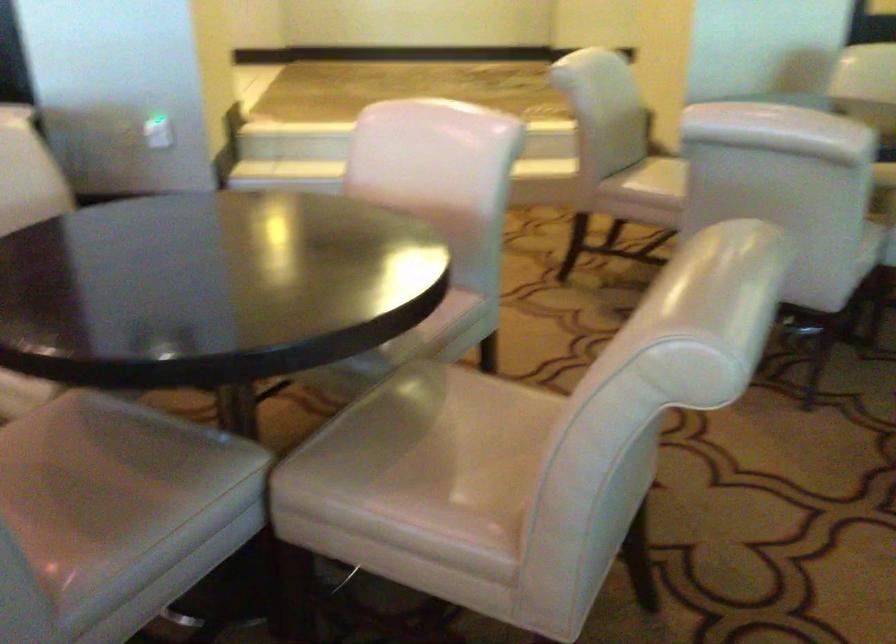
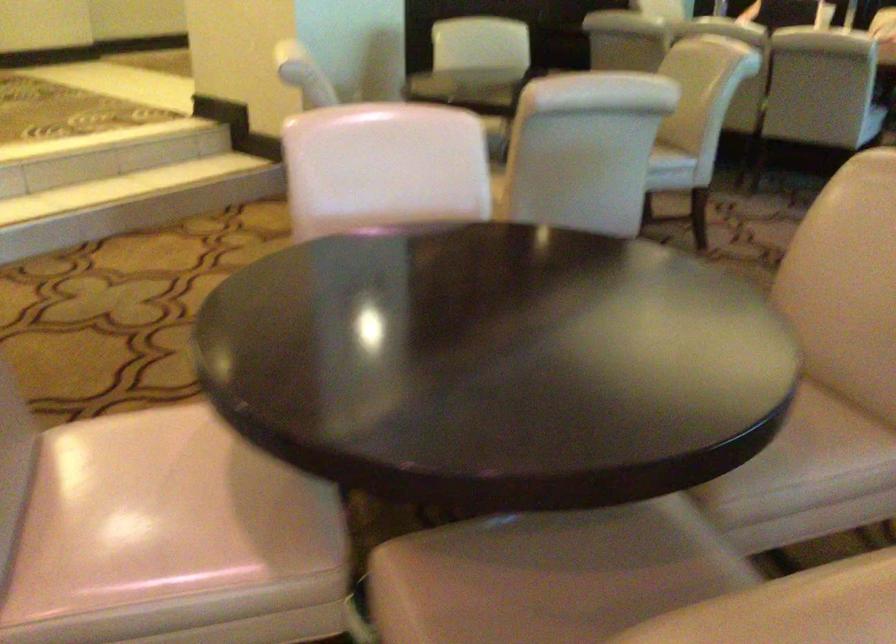
The point at (96, 460) is marked in the first image. Where is the corresponding point in the second image?

(556, 585)